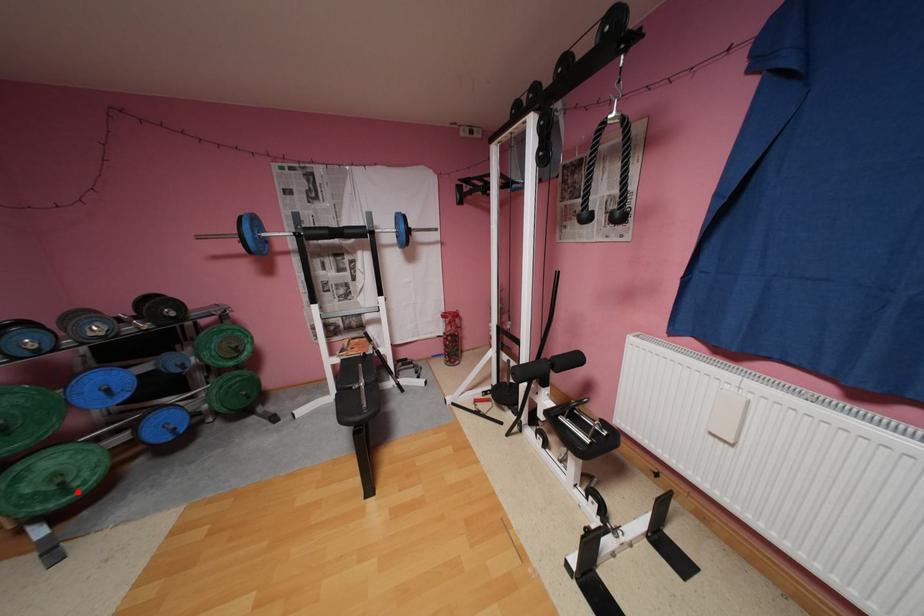
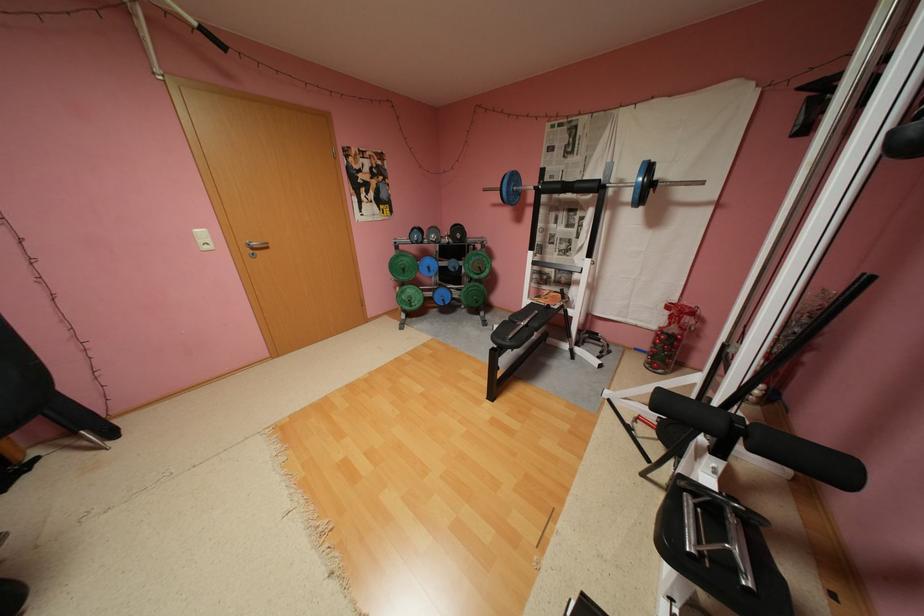
Question: I am providing you with two images of the same scene from different viewpoints. In image1, a red point is highlighted. Considering the same 3D point in image2, which of the following is correct?

Choices:
 (A) It is closer
 (B) It is farther

Answer: (A)